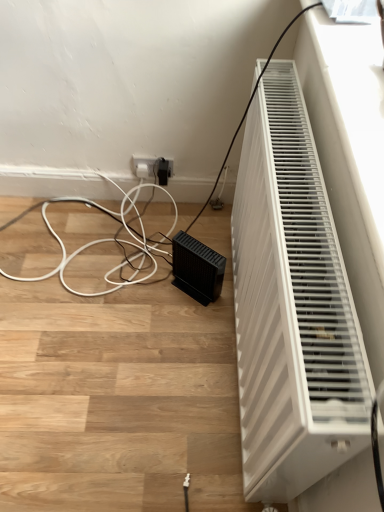
Identify the location of white plastic radiator at right. The image size is (384, 512). (292, 306).

This screenshot has width=384, height=512. What do you see at coordinates (292, 306) in the screenshot? I see `white plastic radiator at right` at bounding box center [292, 306].

What are the coordinates of `black matte speaker at lower center` in the screenshot? It's located at (197, 268).

Describe the element at coordinates (197, 268) in the screenshot. I see `black matte speaker at lower center` at that location.

What is the approximate width of black matte speaker at lower center?

20.96 centimeters.

At what (x,y) coordinates should I click in order to perform the action: click on white plastic radiator at right. Please return your answer as a coordinate pair (x, y). The image size is (384, 512). Looking at the image, I should click on (292, 306).

Which object is positioned more to the left, white plastic radiator at right or black matte speaker at lower center?

black matte speaker at lower center is more to the left.

Is white plastic radiator at right further to the viewer compared to black matte speaker at lower center?

No, it is in front of black matte speaker at lower center.

Considering the positions of point (352, 456) and point (201, 302), is point (352, 456) closer or farther from the camera than point (201, 302)?

Point (352, 456) is positioned closer to the camera compared to point (201, 302).

From the image's perspective, who appears lower, white plastic radiator at right or black matte speaker at lower center?

white plastic radiator at right appears lower in the image.

From a real-world perspective, is white plastic radiator at right physically located above or below black matte speaker at lower center?

From a real-world perspective, white plastic radiator at right is physically above black matte speaker at lower center.

Looking at their sizes, would you say white plastic radiator at right is wider or thinner than black matte speaker at lower center?

Considering their sizes, white plastic radiator at right looks slimmer than black matte speaker at lower center.

Which of these two, white plastic radiator at right or black matte speaker at lower center, stands shorter?

black matte speaker at lower center is shorter.

Consider the image. Is white plastic radiator at right bigger or smaller than black matte speaker at lower center?

Clearly, white plastic radiator at right is larger in size than black matte speaker at lower center.

Is white plastic radiator at right not inside black matte speaker at lower center?

white plastic radiator at right lies outside black matte speaker at lower center's area.

Are white plastic radiator at right and black matte speaker at lower center beside each other?

No, white plastic radiator at right is not touching black matte speaker at lower center.

From the picture: Is white plastic radiator at right looking in the opposite direction of black matte speaker at lower center?

Yes, white plastic radiator at right is facing away from black matte speaker at lower center.

How many degrees apart are the facing directions of white plastic radiator at right and black matte speaker at lower center?

38 degrees separate the facing orientations of white plastic radiator at right and black matte speaker at lower center.

Where is `speaker located behind the white plastic radiator at right`? The height and width of the screenshot is (512, 384). speaker located behind the white plastic radiator at right is located at coordinates (197, 268).

Considering the positions of objects black matte speaker at lower center and white plastic radiator at right in the image provided, who is more to the left, black matte speaker at lower center or white plastic radiator at right?

black matte speaker at lower center is more to the left.

Considering the relative positions of black matte speaker at lower center and white plastic radiator at right in the image provided, is black matte speaker at lower center behind white plastic radiator at right?

Yes, black matte speaker at lower center is behind white plastic radiator at right.

Which is closer to the camera, (214, 289) or (308, 340)?

Point (214, 289) is farther from the camera than point (308, 340).

From the image's perspective, who appears lower, black matte speaker at lower center or white plastic radiator at right?

white plastic radiator at right.

From the picture: From a real-world perspective, is black matte speaker at lower center physically above white plastic radiator at right?

Incorrect, from a real-world perspective, black matte speaker at lower center is lower than white plastic radiator at right.

Does black matte speaker at lower center have a lesser width compared to white plastic radiator at right?

Incorrect, the width of black matte speaker at lower center is not less than that of white plastic radiator at right.

In the scene shown: In terms of height, does black matte speaker at lower center look taller or shorter compared to white plastic radiator at right?

Clearly, black matte speaker at lower center is shorter compared to white plastic radiator at right.

Between black matte speaker at lower center and white plastic radiator at right, which one has smaller size?

black matte speaker at lower center.

Is black matte speaker at lower center outside of white plastic radiator at right?

Yes, black matte speaker at lower center is outside of white plastic radiator at right.

Based on the photo, are black matte speaker at lower center and white plastic radiator at right located far from each other?

black matte speaker at lower center is actually quite close to white plastic radiator at right.

Is black matte speaker at lower center looking in the opposite direction of white plastic radiator at right?

Correct, black matte speaker at lower center is looking away from white plastic radiator at right.

In the scene shown: How different are the orientations of black matte speaker at lower center and white plastic radiator at right in degrees?

The facing directions of black matte speaker at lower center and white plastic radiator at right are 38 degrees apart.

How much distance is there between black matte speaker at lower center and white plastic radiator at right?

A distance of 19.94 inches exists between black matte speaker at lower center and white plastic radiator at right.

This screenshot has width=384, height=512. I want to click on home appliance in front of the black matte speaker at lower center, so coord(292,306).

I want to click on home appliance that appears below the black matte speaker at lower center (from the image's perspective), so click(292, 306).

Locate an element on the screen. The image size is (384, 512). speaker on the left of the white plastic radiator at right is located at coordinates (197, 268).